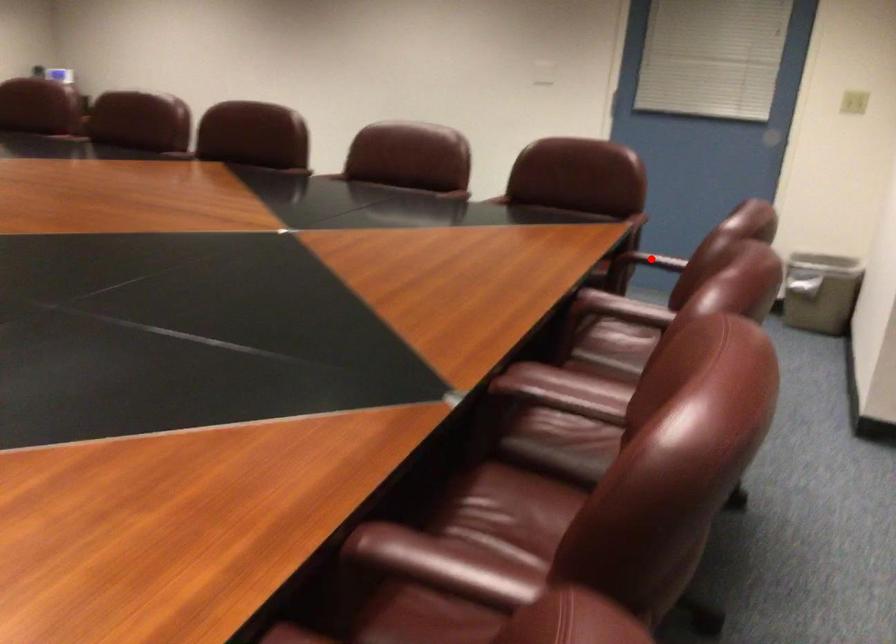
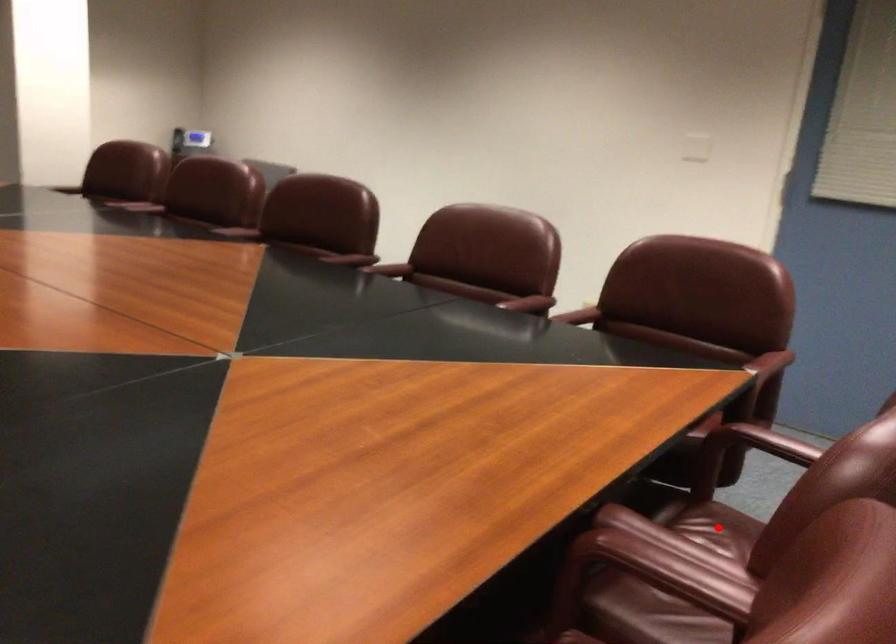
I am providing you with two images of the same scene from different viewpoints. A red point is marked on the first image and another point is marked on the second image. Does the point marked in image1 correspond to the same location as the one in image2?

No